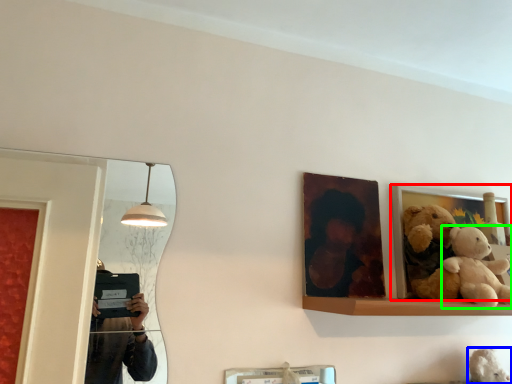
Question: Considering the real-world distances, which object is farthest from picture frame (highlighted by a red box)? teddy (highlighted by a blue box) or teddy bear (highlighted by a green box)?

Choices:
 (A) teddy
 (B) teddy bear

Answer: (A)